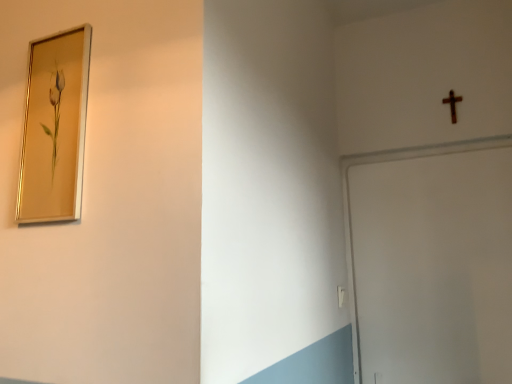
Describe the element at coordinates (54, 128) in the screenshot. Image resolution: width=512 pixels, height=384 pixels. I see `gold metallic picture frame at upper left` at that location.

You are a GUI agent. You are given a task and a screenshot of the screen. Output one action in this format:
    pyautogui.click(x=<x>, y=<y>)
    Task: Click on the gold metallic picture frame at upper left
    
    Given the screenshot: What is the action you would take?
    pyautogui.click(x=54, y=128)

I want to click on gold metallic picture frame at upper left, so click(54, 128).